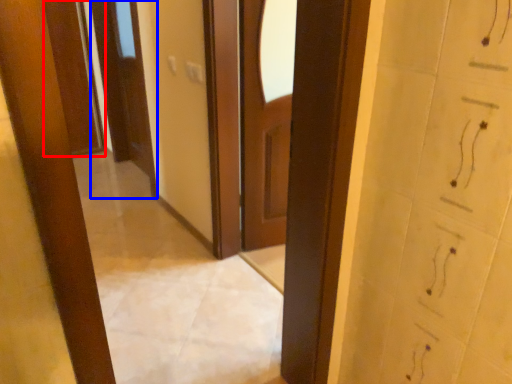
Question: Which object appears farthest to the camera in this image, door (highlighted by a red box) or door (highlighted by a blue box)?

Choices:
 (A) door
 (B) door

Answer: (A)